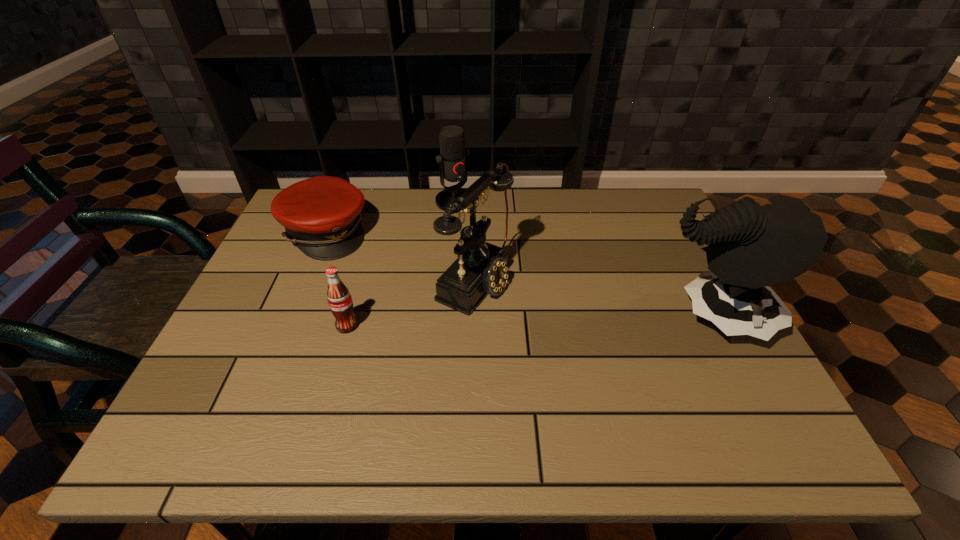
Where is `free space on the desktop that is between the soda and the doll and is positioned on the side of the microphone with the red ring`? Image resolution: width=960 pixels, height=540 pixels. free space on the desktop that is between the soda and the doll and is positioned on the side of the microphone with the red ring is located at coordinates (574, 321).

What are the coordinates of `free spot on the desktop that is between the fourth tallest object and the rightmost object and is positioned on the front of the cap with an emblem` in the screenshot? It's located at (488, 322).

Find the location of a particular element. Image resolution: width=960 pixels, height=540 pixels. free space on the desktop that is between the soda and the rightmost object and is positioned on the dial of the fourth shortest object is located at coordinates (581, 320).